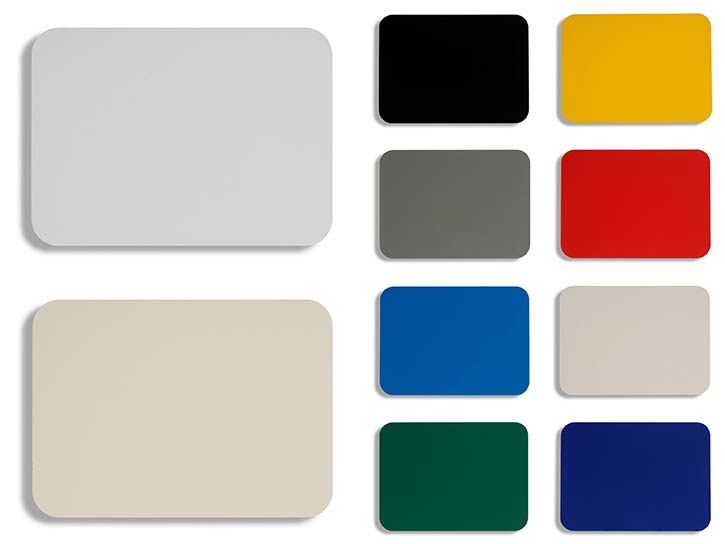
Where is `red tile`? This screenshot has height=544, width=725. red tile is located at coordinates (608, 222).